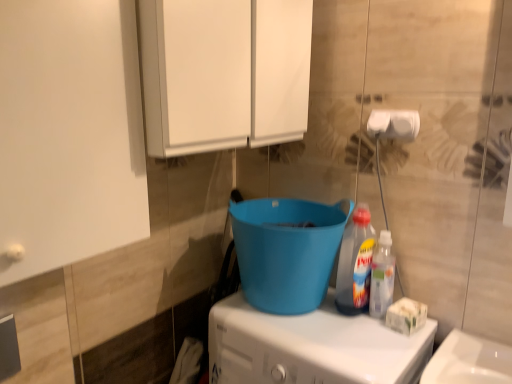
Question: Does point (279, 104) appear closer or farther from the camera than point (262, 200)?

Choices:
 (A) closer
 (B) farther

Answer: (A)

Question: Is white matte cabinet at upper center wider or thinner than blue plastic bucket at center?

Choices:
 (A) thin
 (B) wide

Answer: (B)

Question: Considering the real-world distances, which object is closest to the translucent plastic bottle at right, which is the first bottle from right to left?

Choices:
 (A) white matte toilet paper at upper right
 (B) blue plastic bucket at center
 (C) translucent plastic bottle at center-right, which ranks as the 1th bottle in left-to-right order
 (D) white plastic washing machine at lower center
 (E) white matte cabinet at upper center

Answer: (C)

Question: Estimate the real-world distances between objects in this image. Which object is farther from the translucent plastic bottle at right, the second bottle positioned from the left?

Choices:
 (A) blue plastic bucket at center
 (B) white matte toilet paper at upper right
 (C) white plastic washing machine at lower center
 (D) translucent plastic bottle at center-right, the 2th bottle viewed from the right
 (E) white matte cabinet at upper center

Answer: (E)